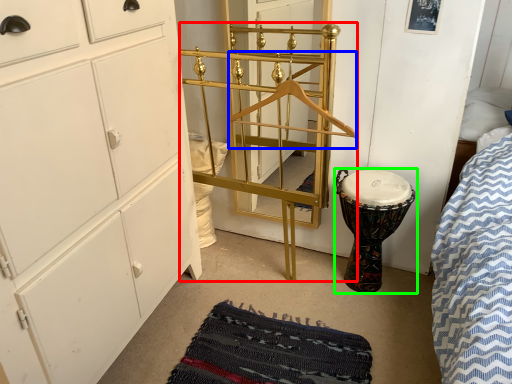
Question: Which object is positioned closest to bunk bed (highlighted by a red box)? Select from hanger (highlighted by a blue box) and drum (highlighted by a green box).

Choices:
 (A) hanger
 (B) drum

Answer: (A)